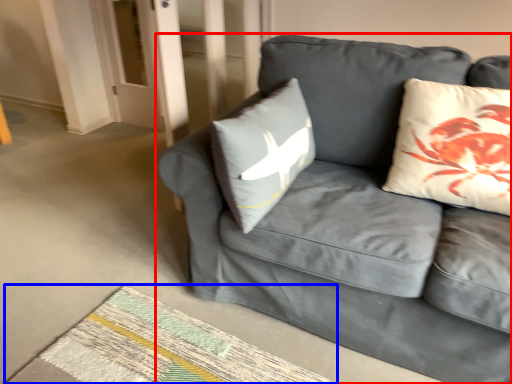
Question: Which point is further to the camera, studio couch (highlighted by a red box) or mat (highlighted by a blue box)?

Choices:
 (A) studio couch
 (B) mat

Answer: (B)